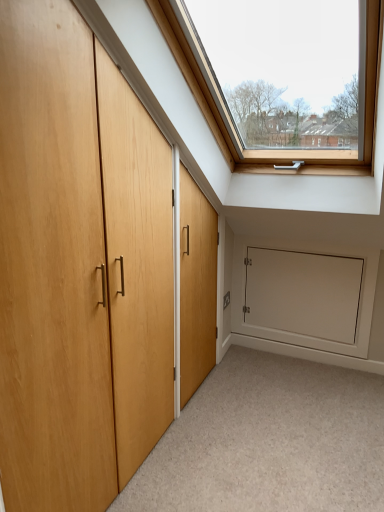
This screenshot has height=512, width=384. I want to click on unoccupied region to the right of light wood door at left, so click(263, 434).